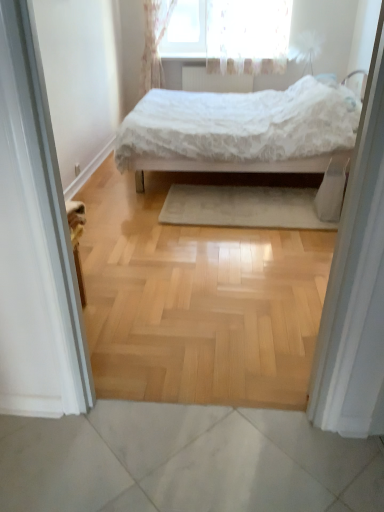
Locate an element on the screen. The width and height of the screenshot is (384, 512). free region under white fabric screen door at left, the 1th screen door from the left (from a real-world perspective) is located at coordinates pyautogui.click(x=90, y=313).